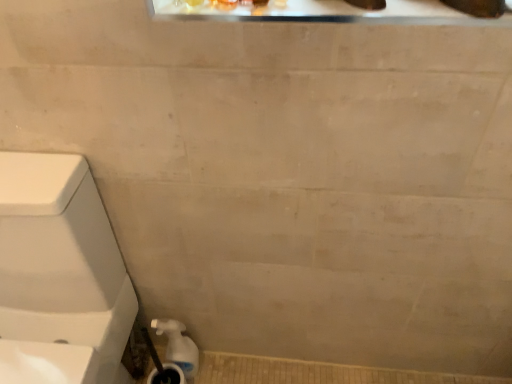
Question: Choose the correct answer: Is white glossy water pipe at lower left inside white glossy toilet at left or outside it?

Choices:
 (A) outside
 (B) inside

Answer: (A)

Question: Is white glossy water pipe at lower left taller or shorter than white glossy toilet at left?

Choices:
 (A) tall
 (B) short

Answer: (B)

Question: From the image's perspective, is white glossy water pipe at lower left above or below white glossy toilet at left?

Choices:
 (A) above
 (B) below

Answer: (B)

Question: Considering the relative positions of white glossy toilet at left and white glossy water pipe at lower left in the image provided, is white glossy toilet at left to the left or to the right of white glossy water pipe at lower left?

Choices:
 (A) right
 (B) left

Answer: (B)

Question: From the image's perspective, is white glossy toilet at left located above or below white glossy water pipe at lower left?

Choices:
 (A) above
 (B) below

Answer: (A)

Question: Looking at the image, does white glossy toilet at left seem bigger or smaller compared to white glossy water pipe at lower left?

Choices:
 (A) small
 (B) big

Answer: (B)

Question: Does point (52, 271) appear closer or farther from the camera than point (169, 327)?

Choices:
 (A) closer
 (B) farther

Answer: (A)